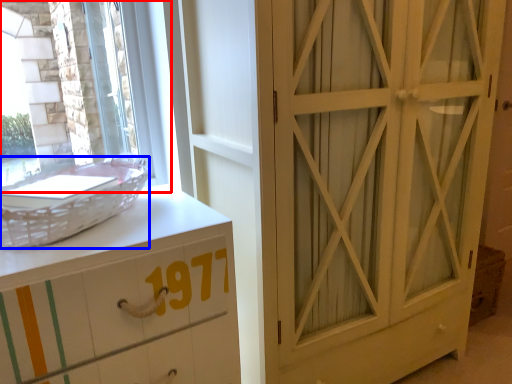
Question: Among these objects, which one is farthest to the camera, window (highlighted by a red box) or basket (highlighted by a blue box)?

Choices:
 (A) window
 (B) basket

Answer: (A)